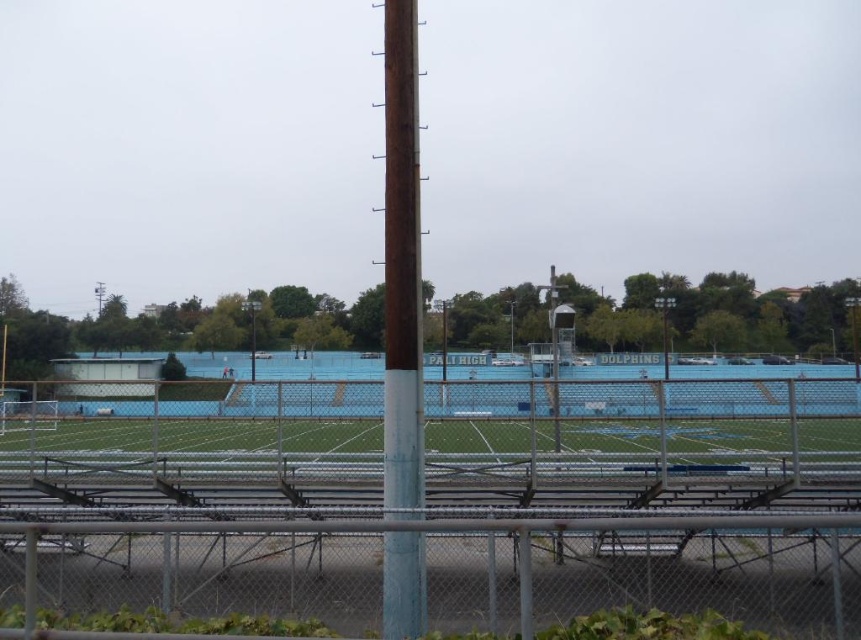
Who is shorter, metallic chain-link fence at center or rusty wood pole at center?

With less height is metallic chain-link fence at center.

Between point (333, 589) and point (416, 497), which one is positioned behind?

Positioned behind is point (416, 497).

Between point (166, 529) and point (407, 508), which one is positioned in front?

Point (166, 529) is more forward.

This screenshot has width=861, height=640. I want to click on metallic chain-link fence at center, so click(437, 509).